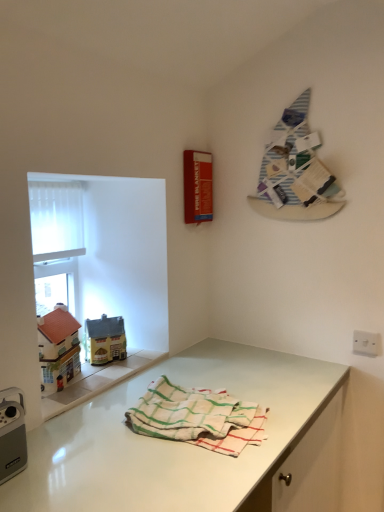
The width and height of the screenshot is (384, 512). Find the location of `white translucent screen at upper left`. white translucent screen at upper left is located at coordinates click(56, 219).

Find the location of `matte plastic toy house at left, the 1th toy viewed from the front`. matte plastic toy house at left, the 1th toy viewed from the front is located at coordinates (57, 347).

Find the location of `white woven towel at center`. white woven towel at center is located at coordinates (198, 417).

Find the location of a particular element. The image size is (384, 512). towel in front of the white plastic switch at lower right is located at coordinates (198, 417).

From the image's perspective, who appears lower, white plastic switch at lower right or white woven towel at center?

From the image's view, white woven towel at center is below.

Is white plastic switch at lower right oriented towards white woven towel at center?

No, white plastic switch at lower right is not turned towards white woven towel at center.

Is white plastic switch at lower right next to white woven towel at center?

No.

How different are the orientations of white glossy window sill at lower left and white translucent screen at upper left in degrees?

0.364 degrees separate the facing orientations of white glossy window sill at lower left and white translucent screen at upper left.

Between white glossy window sill at lower left and white translucent screen at upper left, which one has more height?

white translucent screen at upper left is taller.

Between white glossy window sill at lower left and white translucent screen at upper left, which one is positioned in front?

white glossy window sill at lower left.

Based on the photo, considering the relative sizes of white glossy window sill at lower left and white translucent screen at upper left in the image provided, is white glossy window sill at lower left bigger than white translucent screen at upper left?

No.

From the image's perspective, is striped fabric at upper right beneath white glossy countertop at lower center?

Actually, striped fabric at upper right appears above white glossy countertop at lower center in the image.

From a real-world perspective, which object rests below the other?

white glossy countertop at lower center.

Considering the positions of objects striped fabric at upper right and white glossy countertop at lower center in the image provided, who is in front, striped fabric at upper right or white glossy countertop at lower center?

Positioned in front is white glossy countertop at lower center.

Is striped fabric at upper right at the right side of white glossy countertop at lower center?

Yes, striped fabric at upper right is to the right of white glossy countertop at lower center.

Considering the sizes of objects striped fabric at upper right and white translucent screen at upper left in the image provided, who is wider, striped fabric at upper right or white translucent screen at upper left?

striped fabric at upper right.

Considering the relative sizes of striped fabric at upper right and white translucent screen at upper left in the image provided, is striped fabric at upper right bigger than white translucent screen at upper left?

Correct, striped fabric at upper right is larger in size than white translucent screen at upper left.

Which is farther from the camera, [258,186] or [34,185]?

The point [258,186] is farther from the camera.

Does white plastic switch at lower right have a greater height compared to white translucent screen at upper left?

Incorrect, the height of white plastic switch at lower right is not larger of that of white translucent screen at upper left.

Locate an element on the screen. The height and width of the screenshot is (512, 384). electric outlet behind the white translucent screen at upper left is located at coordinates (366, 343).

From the image's perspective, is white plastic switch at lower right on top of white translucent screen at upper left?

No, from the image's perspective, white plastic switch at lower right is not on top of white translucent screen at upper left.

How much distance is there between white glossy countertop at lower center and white glossy window sill at lower left?

A distance of 9.26 inches exists between white glossy countertop at lower center and white glossy window sill at lower left.

From a real-world perspective, relative to white glossy window sill at lower left, is white glossy countertop at lower center vertically above or below?

Clearly, from a real-world perspective, white glossy countertop at lower center is below white glossy window sill at lower left.

Can you tell me how much white glossy countertop at lower center and white glossy window sill at lower left differ in facing direction?

There is a 0.494-degree angle between the facing directions of white glossy countertop at lower center and white glossy window sill at lower left.

Who is bigger, white glossy countertop at lower center or white glossy window sill at lower left?

With larger size is white glossy countertop at lower center.

Which object is further away from the camera taking this photo, white woven towel at center or white translucent screen at upper left?

Positioned behind is white translucent screen at upper left.

Does point (182, 440) appear closer or farther from the camera than point (38, 187)?

Point (182, 440).

Identify the location of towel on the left of white plastic switch at lower right. This screenshot has height=512, width=384. (198, 417).

The height and width of the screenshot is (512, 384). I want to click on window sill in front of the white translucent screen at upper left, so click(97, 382).

Based on their spatial positions, is striped fabric at upper right or white plastic switch at lower right closer to white woven towel at center?

white plastic switch at lower right is closer to white woven towel at center.

Looking at the image, which one is located further to striped fabric at upper right, matte yellow house at left, which appears as the second toy when viewed from the front, or white translucent screen at upper left?

matte yellow house at left, which appears as the second toy when viewed from the front, is positioned further to the anchor striped fabric at upper right.

Based on their spatial positions, is matte yellow house at left, the 1th toy when ordered from right to left, or white plastic switch at lower right further from white translucent screen at upper left?

white plastic switch at lower right.

When comparing their distances from matte plastic toy house at left, the 1th toy when ordered from left to right, does white woven towel at center or white glossy window sill at lower left seem further?

Based on the image, white woven towel at center appears to be further to matte plastic toy house at left, the 1th toy when ordered from left to right.

Estimate the real-world distances between objects in this image. Which object is closer to white plastic switch at lower right, white glossy window sill at lower left or white woven towel at center?

white woven towel at center is positioned closer to the anchor white plastic switch at lower right.

Based on their spatial positions, is white translucent screen at upper left or white glossy countertop at lower center further from white plastic switch at lower right?

Among the two, white translucent screen at upper left is located further to white plastic switch at lower right.

Based on their spatial positions, is matte yellow house at left, which appears as the second toy when viewed from the front, or white plastic switch at lower right closer to white glossy countertop at lower center?

matte yellow house at left, which appears as the second toy when viewed from the front.

Based on their spatial positions, is white woven towel at center or white glossy countertop at lower center closer to matte plastic toy house at left, the second toy in the right-to-left sequence?

The object closer to matte plastic toy house at left, the second toy in the right-to-left sequence, is white glossy countertop at lower center.

You are a GUI agent. You are given a task and a screenshot of the screen. Output one action in this format:
    pyautogui.click(x=<x>, y=<y>)
    Task: Click on the towel between white translucent screen at upper left and white glossy countertop at lower center in the up-down direction
    The width and height of the screenshot is (384, 512).
    Given the screenshot: What is the action you would take?
    pyautogui.click(x=198, y=417)

In order to click on electric outlet between striped fabric at upper right and white glossy countertop at lower center in the up-down direction in this screenshot , I will do `click(366, 343)`.

Locate an element on the screen. This screenshot has height=512, width=384. electric outlet between white glossy countertop at lower center and matte yellow house at left, which appears as the second toy when viewed from the front, from front to back is located at coordinates (366, 343).

Image resolution: width=384 pixels, height=512 pixels. I want to click on towel between matte yellow house at left, which is counted as the first toy, starting from the back, and white plastic switch at lower right from left to right, so click(198, 417).